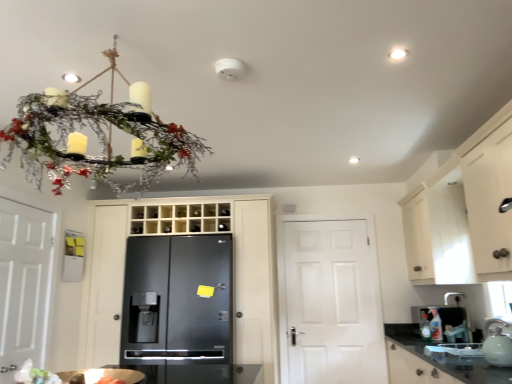
Question: Is white glossy tea pot at lower right facing away from white matte door at left, which is counted as the 3th door, starting from the right?

Choices:
 (A) yes
 (B) no

Answer: (B)

Question: From a real-world perspective, is white glossy tea pot at lower right positioned over white matte door at left, which is the first door in left-to-right order, based on gravity?

Choices:
 (A) yes
 (B) no

Answer: (B)

Question: Is white glossy tea pot at lower right at the right side of white matte door at left, which is the first door in left-to-right order?

Choices:
 (A) no
 (B) yes

Answer: (B)

Question: Is white glossy tea pot at lower right bigger than white matte door at left, which is the first door in left-to-right order?

Choices:
 (A) no
 (B) yes

Answer: (A)

Question: Considering the relative sizes of white glossy tea pot at lower right and white matte door at left, which is counted as the 3th door, starting from the right, in the image provided, is white glossy tea pot at lower right shorter than white matte door at left, which is counted as the 3th door, starting from the right,?

Choices:
 (A) yes
 (B) no

Answer: (A)

Question: Does white glossy tea pot at lower right have a greater height compared to white matte door at left, which is the first door in left-to-right order?

Choices:
 (A) no
 (B) yes

Answer: (A)

Question: Is black matte refrigerator at center completely or partially outside of glossy black refrigerator at center, marked as the second door in a left-to-right arrangement?

Choices:
 (A) no
 (B) yes

Answer: (A)

Question: From the image's perspective, is black matte refrigerator at center on top of glossy black refrigerator at center, the second door when ordered from right to left?

Choices:
 (A) no
 (B) yes

Answer: (A)

Question: Can you confirm if black matte refrigerator at center is smaller than glossy black refrigerator at center, the second door when ordered from right to left?

Choices:
 (A) yes
 (B) no

Answer: (A)

Question: From a real-world perspective, is black matte refrigerator at center beneath glossy black refrigerator at center, the second door when ordered from right to left?

Choices:
 (A) no
 (B) yes

Answer: (B)

Question: Could you tell me if black matte refrigerator at center is turned towards glossy black refrigerator at center, marked as the second door in a left-to-right arrangement?

Choices:
 (A) no
 (B) yes

Answer: (B)

Question: Can you confirm if black matte refrigerator at center is shorter than glossy black refrigerator at center, marked as the second door in a left-to-right arrangement?

Choices:
 (A) no
 (B) yes

Answer: (B)

Question: Is matte white chandelier at upper left taller than black matte refrigerator at center?

Choices:
 (A) yes
 (B) no

Answer: (B)